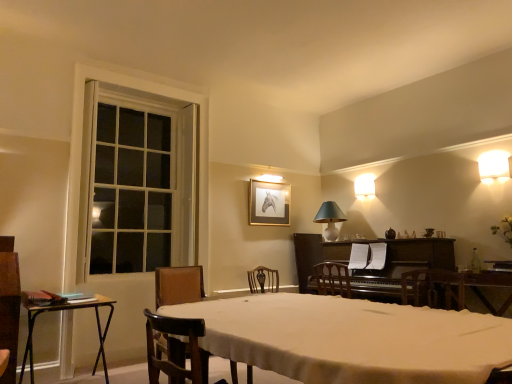
Where is `vacant space situated above metallic gold picture frame at upper center (from a real-world perspective)`? The width and height of the screenshot is (512, 384). vacant space situated above metallic gold picture frame at upper center (from a real-world perspective) is located at coordinates (269, 183).